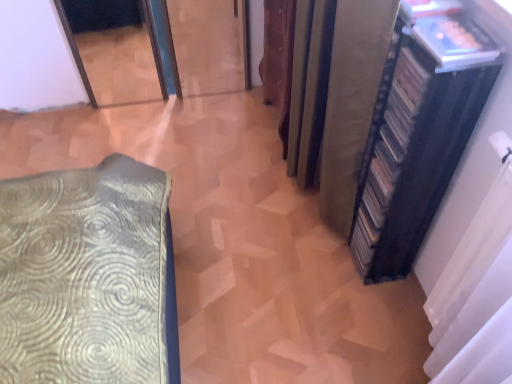
In order to click on vacant area on top of black matte bookshelf at right (from a real-world perspective) in this screenshot , I will do `click(439, 31)`.